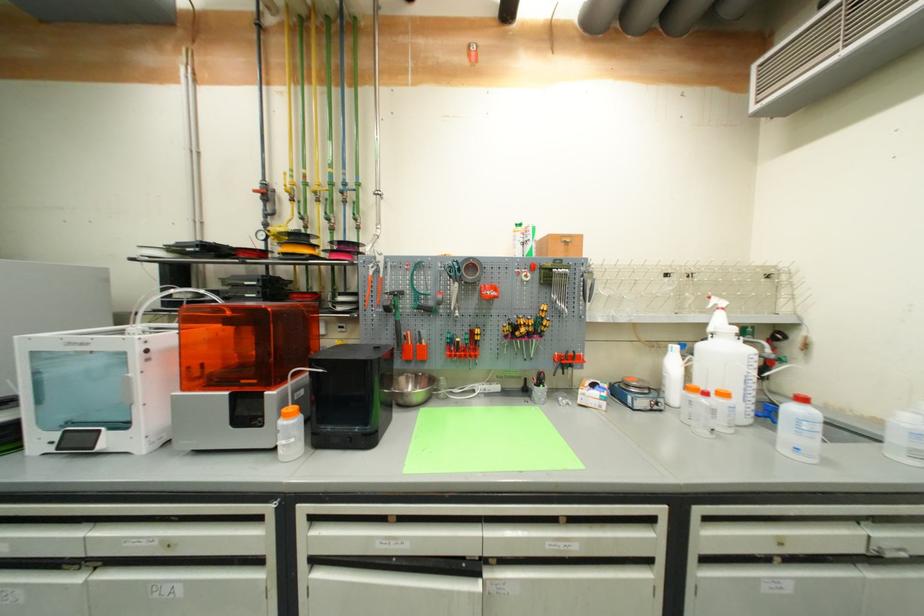
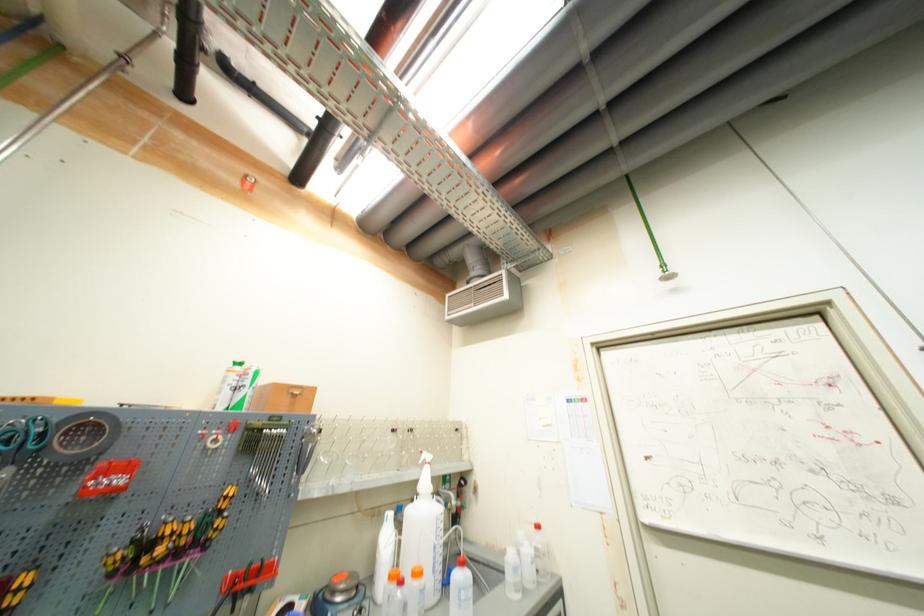
Locate, in the second image, the point that corresponds to point 456,274 in the first image.

(14, 445)